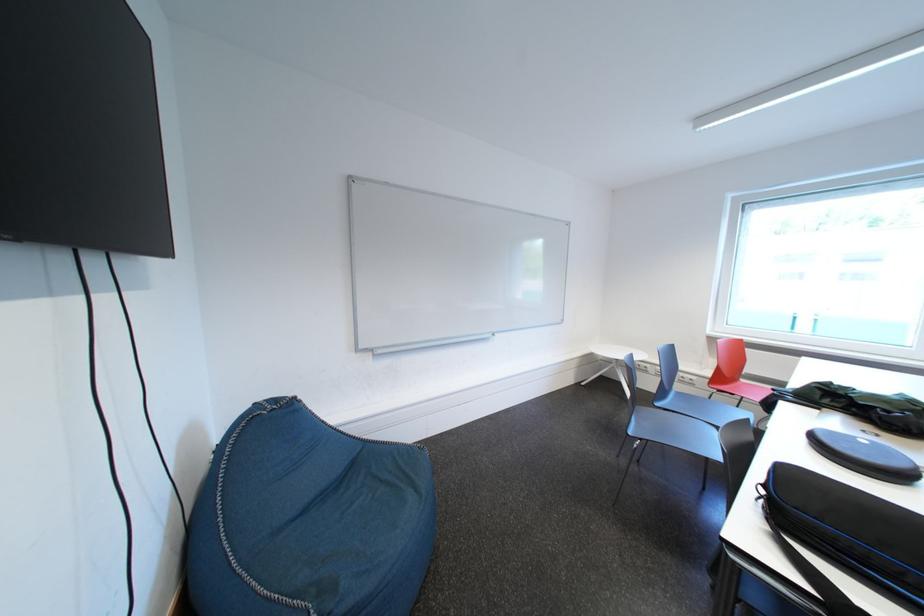
Where is `blue beanbag surface`? blue beanbag surface is located at coordinates (309, 520).